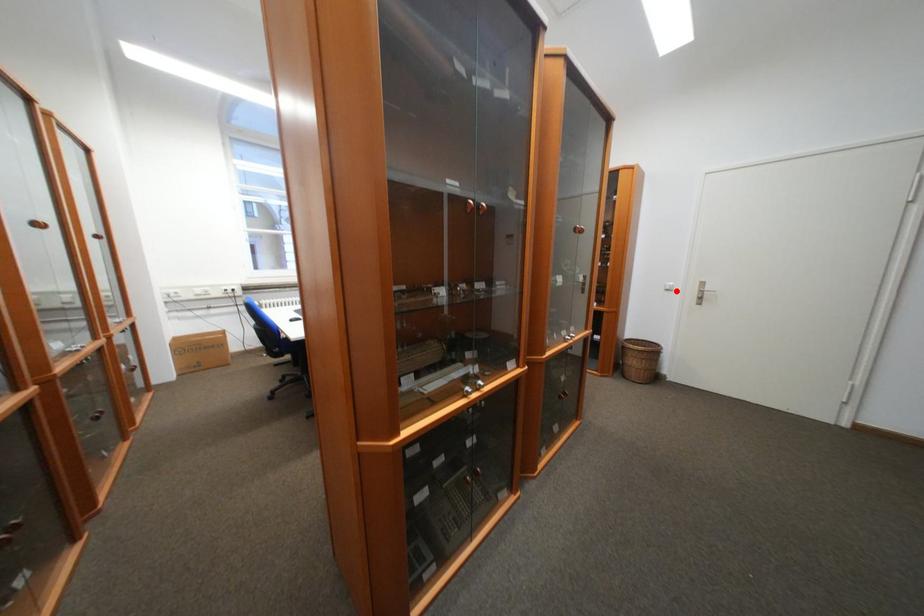
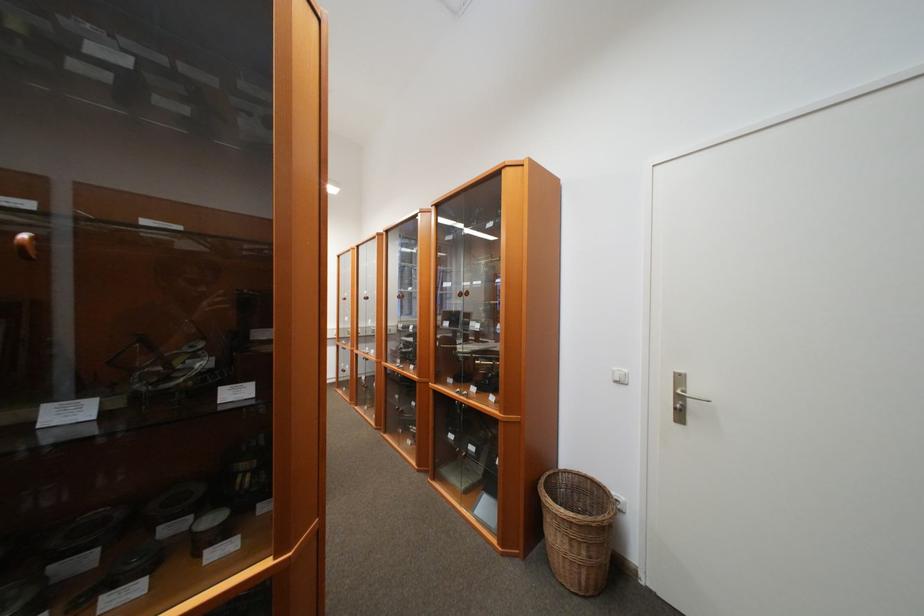
Where in the second image is the point corresponding to the highlighted location from the first image?

(626, 383)